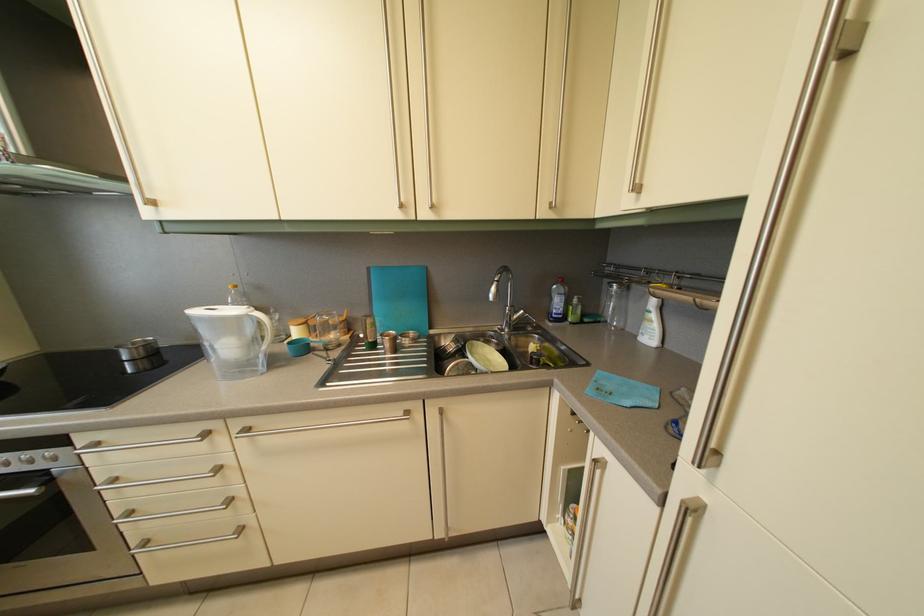
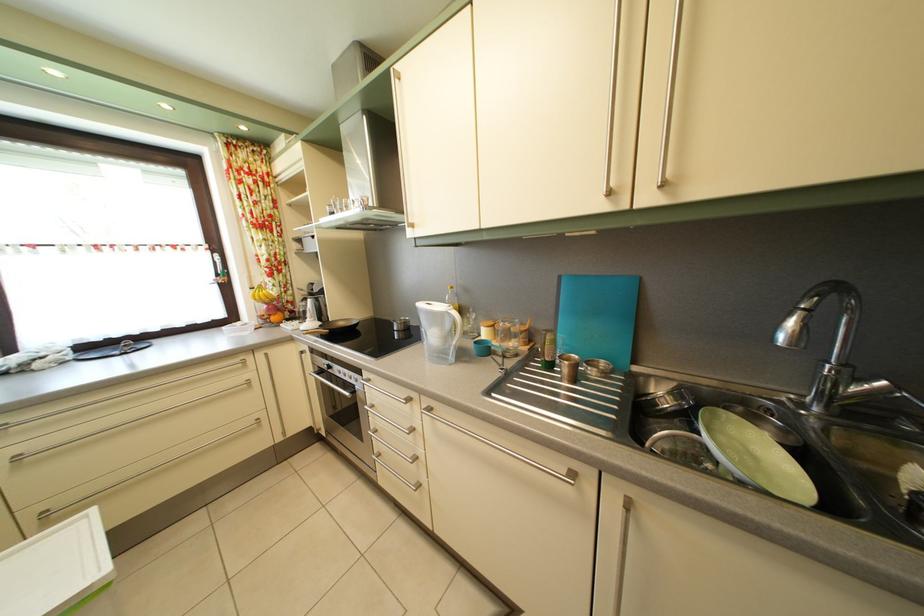
The point at (59, 460) is marked in the first image. Where is the corresponding point in the second image?

(365, 384)